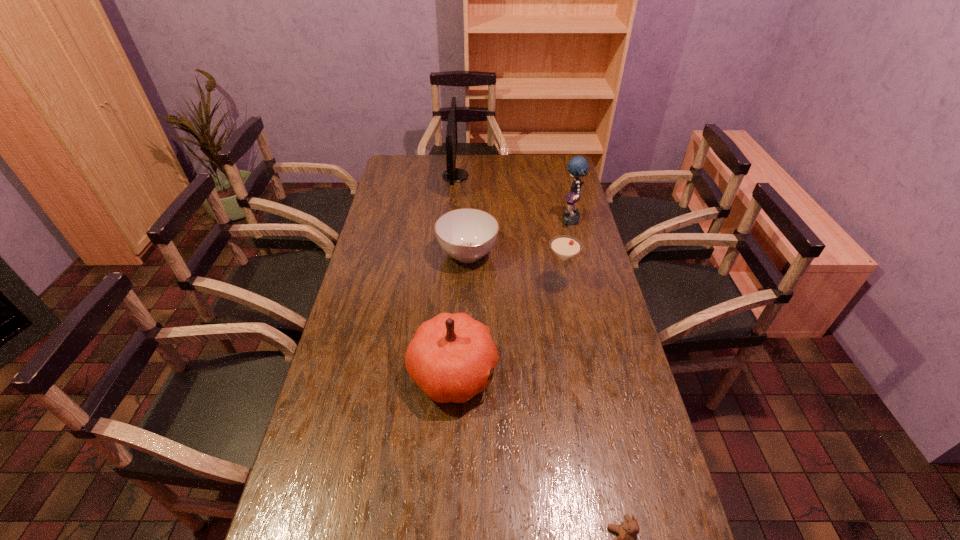
You are a GUI agent. You are given a task and a screenshot of the screen. Output one action in this format:
    pyautogui.click(x=<x>, y=<y>)
    Task: Click on the vacant region located 0.310m on the front-facing side of the pumpkin
    The width and height of the screenshot is (960, 540).
    Given the screenshot: What is the action you would take?
    [x=606, y=373]

Image resolution: width=960 pixels, height=540 pixels. Identify the location of vacant position located 0.210m on the left of the third shortest object. (485, 282).

Identify the location of blank space located on the front of the second shortest object. (464, 367).

Where is `object that is at the far edge`? object that is at the far edge is located at coordinates (452, 174).

Where is `rag doll located in the right edge section of the desktop`? The height and width of the screenshot is (540, 960). rag doll located in the right edge section of the desktop is located at coordinates (577, 166).

You are a GUI agent. You are given a task and a screenshot of the screen. Output one action in this format:
    pyautogui.click(x=<x>, y=<y>)
    Task: Click on the martini located in the right edge section of the desktop
    The image size is (960, 540).
    Given the screenshot: What is the action you would take?
    pyautogui.click(x=565, y=247)

Locate an element on the screen. Image resolution: width=960 pixels, height=540 pixels. free space at the far edge of the desktop is located at coordinates (443, 154).

Image resolution: width=960 pixels, height=540 pixels. I want to click on vacant space at the left edge of the desktop, so click(408, 184).

At what (x,y) coordinates should I click in order to perform the action: click on vacant region at the right edge of the desktop. Please return your answer as a coordinate pair (x, y). The width and height of the screenshot is (960, 540). Looking at the image, I should click on (665, 503).

Locate an element on the screen. free point at the far right corner is located at coordinates (555, 169).